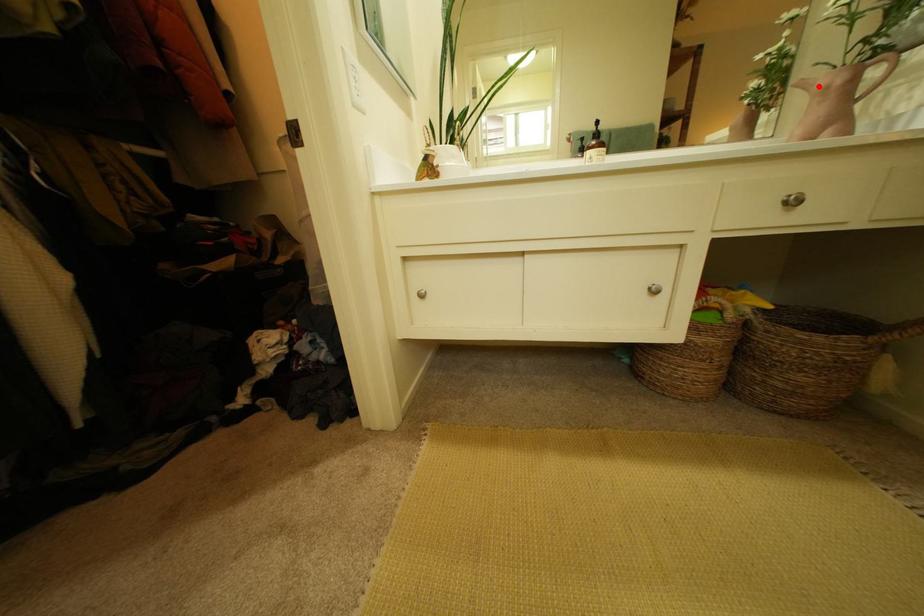
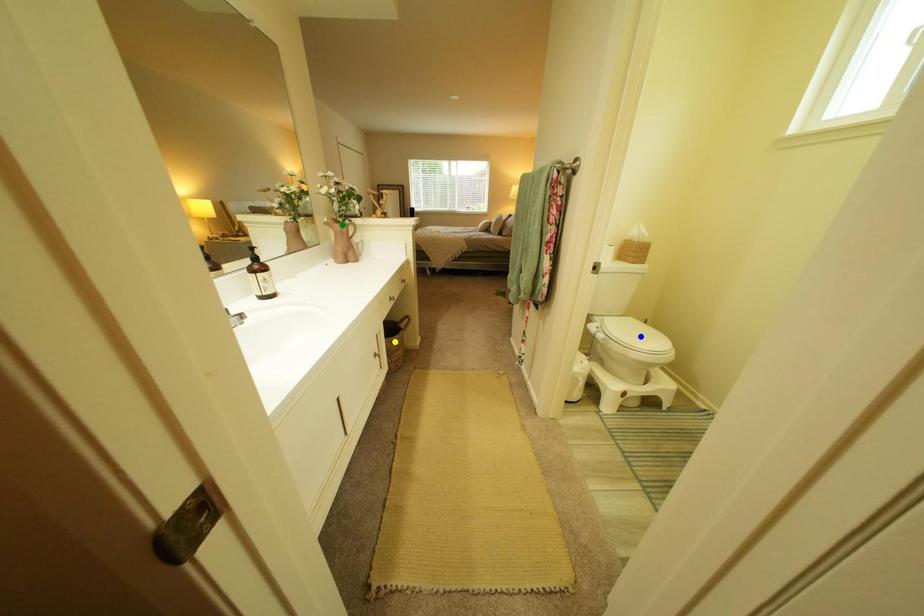
Question: I am providing you with two images of the same scene from different viewpoints. A red point is marked on the first image. You are given multiple points on the second image. Can you choose the point in image 2 that corresponds to the point in image 1?

Choices:
 (A) yellow point
 (B) blue point
 (C) green point

Answer: (C)